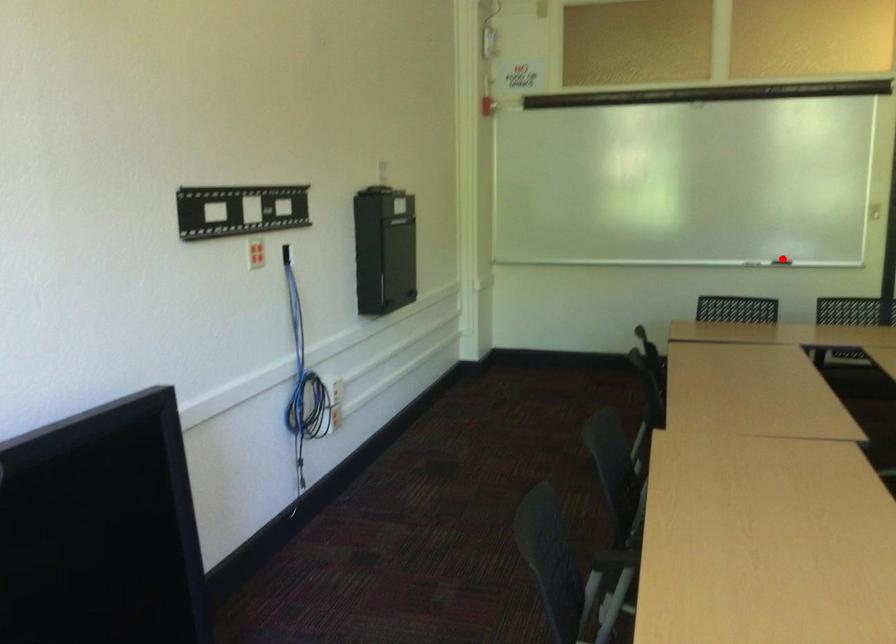
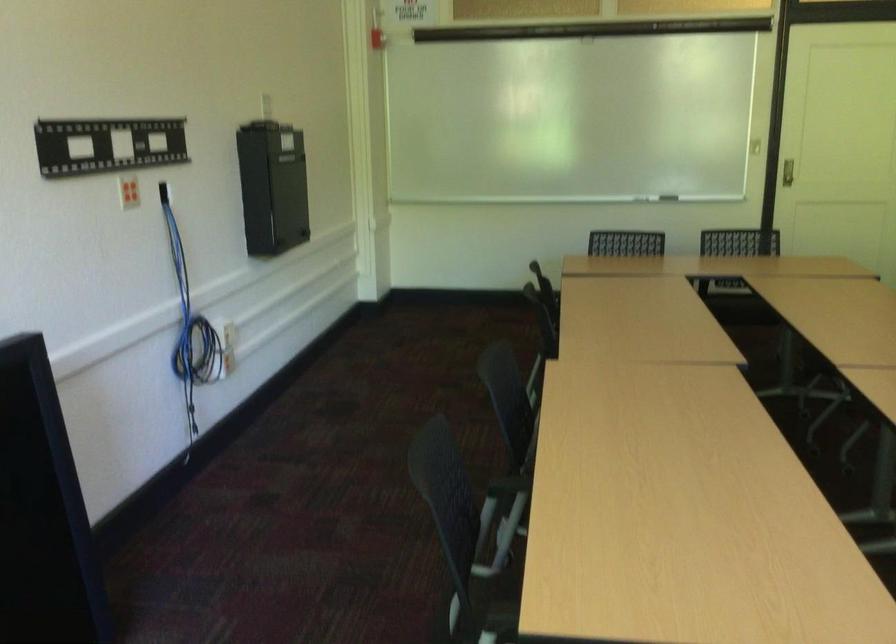
Question: I am providing you with two images of the same scene from different viewpoints. A red point is marked on the first image. Is the red point's position out of view in image 2?

Choices:
 (A) Yes
 (B) No

Answer: (B)